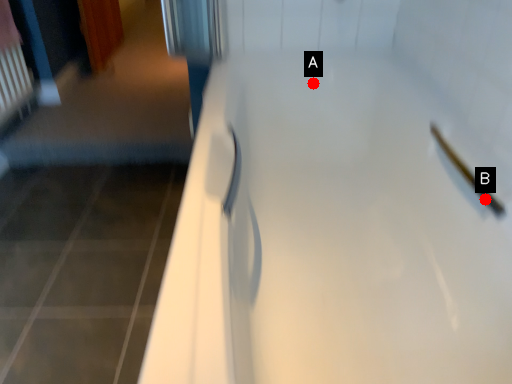
Question: Two points are circled on the image, labeled by A and B beside each circle. Among these points, which one is nearest to the camera?

Choices:
 (A) A is closer
 (B) B is closer

Answer: (B)